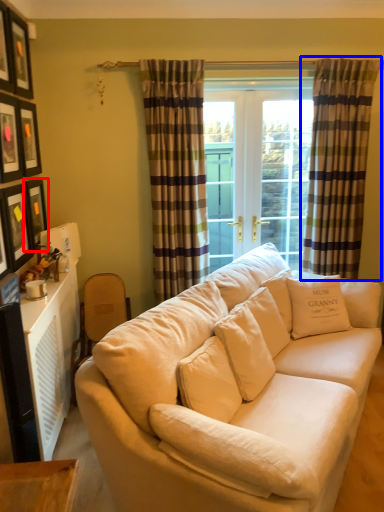
Question: Among these objects, which one is nearest to the camera, picture frame (highlighted by a red box) or curtain (highlighted by a blue box)?

Choices:
 (A) picture frame
 (B) curtain

Answer: (A)